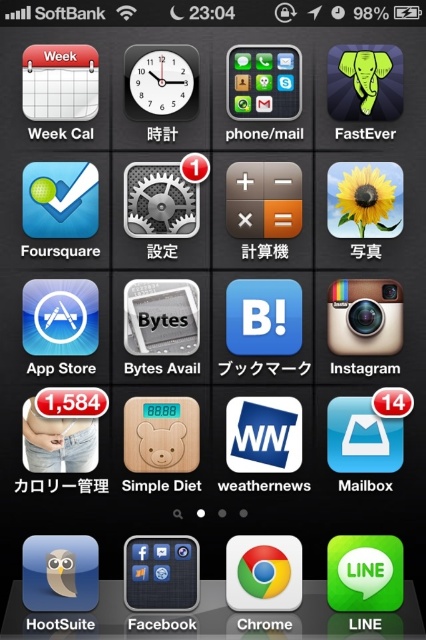
Does green matte line at bottom right have a greater height compared to matte black grid at center?

No, green matte line at bottom right is not taller than matte black grid at center.

Which is below, green matte line at bottom right or matte black grid at center?

Positioned lower is green matte line at bottom right.

You are a GUI agent. You are given a task and a screenshot of the screen. Output one action in this format:
    pyautogui.click(x=<x>, y=<y>)
    Task: Click on the green matte line at bottom right
    The height and width of the screenshot is (640, 426).
    Given the screenshot: What is the action you would take?
    pyautogui.click(x=365, y=572)

Find the location of a particular element. matte black smartphone at center is located at coordinates (161, 572).

Does point (337, 582) lie behind point (290, 588)?

No, it is in front of (290, 588).

Can you confirm if green matte line at bottom right is shorter than chromeshiny/reflectivebrowser at center?

Indeed, green matte line at bottom right has a lesser height compared to chromeshiny/reflectivebrowser at center.

Describe the element at coordinates (365, 572) in the screenshot. I see `green matte line at bottom right` at that location.

Identify the location of green matte line at bottom right. The height and width of the screenshot is (640, 426). (365, 572).